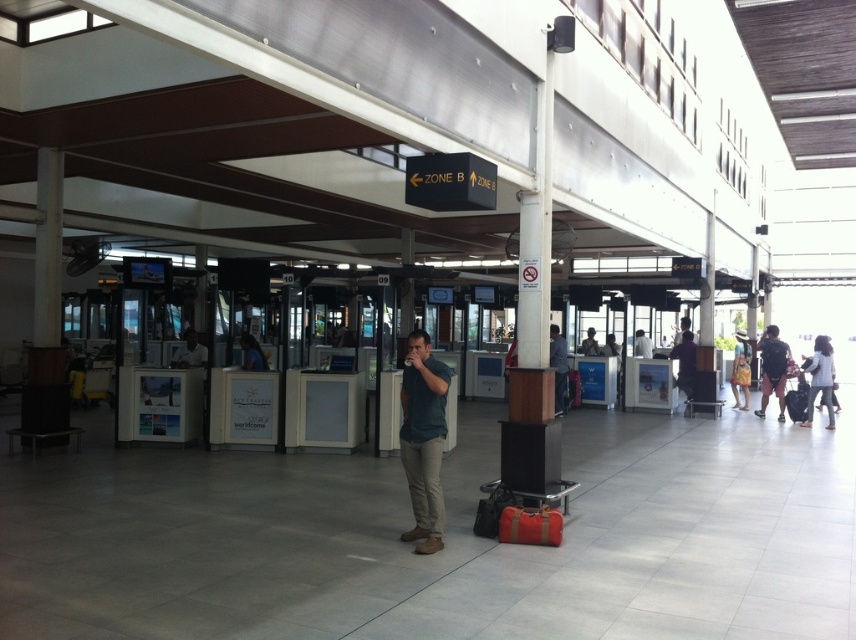
You are standing in the airport terminal and want to take a photo of both the man in the teal shirt and the checkin counter. The man is at point (x=825, y=349) and the checkin counter is at point (x=675, y=344). Since you want both in the frame, which point is closer to you so you can adjust your camera angle accordingly?

Point (x=825, y=349) is closer to the camera than point (x=675, y=344), so you should adjust your camera angle to ensure both points are in the frame by focusing on the closer point first.

You are a photographer positioned at the entrance of the terminal. You need to capture a photo of both the dark gray shirt at center and the white fabric shirt at center without any overlap between them. Based on their widths, can you determine which one you should position closer to the camera to ensure they don not overlap?

The dark gray shirt at center has a lesser width compared to the white fabric shirt at center. To prevent overlap, position the darker gray shirt closer to the camera since it is narrower and will take up less space in the frame.